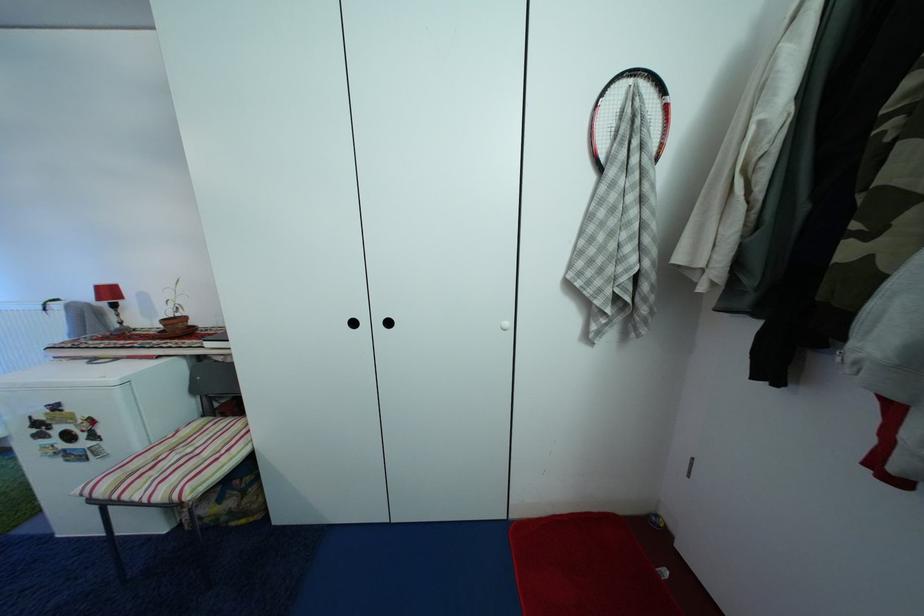
What do you see at coordinates (101, 359) in the screenshot? I see `the black recessed handle` at bounding box center [101, 359].